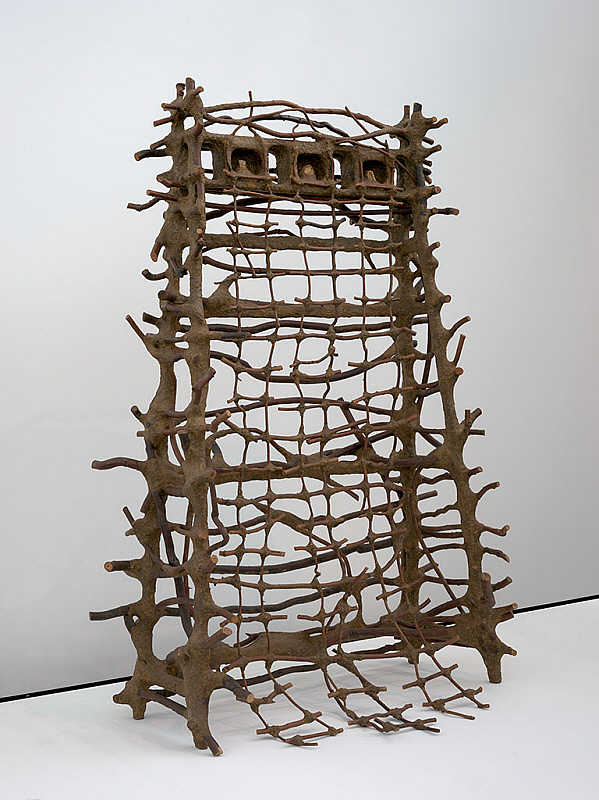
The height and width of the screenshot is (800, 599). I want to click on white surface, so click(552, 704).